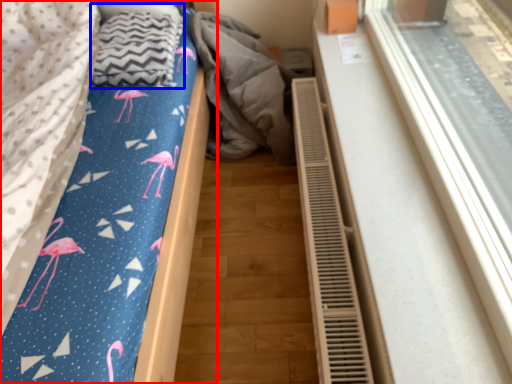
Question: Which object is closer to the camera taking this photo, bed (highlighted by a red box) or blanket (highlighted by a blue box)?

Choices:
 (A) bed
 (B) blanket

Answer: (A)